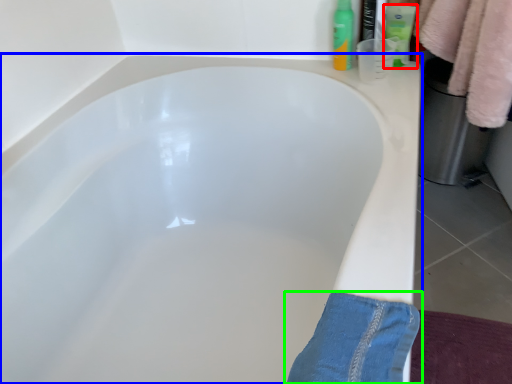
Question: Based on their relative distances, which object is farther from toiletry (highlighted by a red box)? Choose from bathtub (highlighted by a blue box) and trousers (highlighted by a green box).

Choices:
 (A) bathtub
 (B) trousers

Answer: (B)